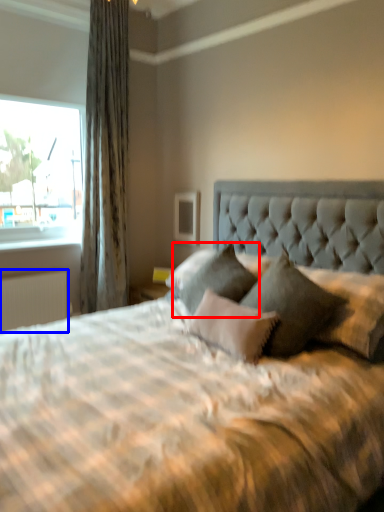
Question: Which point is closer to the camera, pillow (highlighted by a red box) or radiator (highlighted by a blue box)?

Choices:
 (A) pillow
 (B) radiator

Answer: (A)